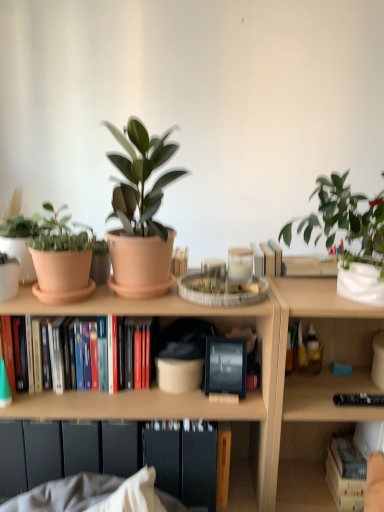
Question: From a real-world perspective, is white matte vase at upper right, the 2th flowerpot from the left, under hardcover books at center left, which is counted as the 2th book, starting from the bottom?

Choices:
 (A) yes
 (B) no

Answer: (B)

Question: From the image's perspective, is white matte vase at upper right, the 1th flowerpot positioned from the right, under hardcover books at center left, which is counted as the 1th book, starting from the top?

Choices:
 (A) no
 (B) yes

Answer: (A)

Question: Considering the relative sizes of white matte vase at upper right, the 2th flowerpot from the left, and hardcover books at center left, which is counted as the 1th book, starting from the top, in the image provided, is white matte vase at upper right, the 2th flowerpot from the left, smaller than hardcover books at center left, which is counted as the 1th book, starting from the top,?

Choices:
 (A) yes
 (B) no

Answer: (A)

Question: Can you confirm if white matte vase at upper right, the 2th flowerpot from the left, is taller than hardcover books at center left, which is counted as the 2th book, starting from the bottom?

Choices:
 (A) yes
 (B) no

Answer: (B)

Question: Are white matte vase at upper right, the 2th flowerpot from the left, and hardcover books at center left, which is counted as the 2th book, starting from the bottom, located far from each other?

Choices:
 (A) no
 (B) yes

Answer: (A)

Question: Visually, is matte terracotta pot at center, which appears as the second houseplant when viewed from the back, positioned to the left or to the right of hardcover books at center left, acting as the 2th book starting from the right?

Choices:
 (A) right
 (B) left

Answer: (A)

Question: Looking at their shapes, would you say matte terracotta pot at center, the first houseplant in the left-to-right sequence, is wider or thinner than hardcover books at center left, acting as the first book starting from the left?

Choices:
 (A) thin
 (B) wide

Answer: (B)

Question: Do you think matte terracotta pot at center, the first houseplant in the left-to-right sequence, is within hardcover books at center left, acting as the first book starting from the left, or outside of it?

Choices:
 (A) inside
 (B) outside

Answer: (B)

Question: Based on their sizes in the image, would you say matte terracotta pot at center, which appears as the second houseplant when viewed from the back, is bigger or smaller than hardcover books at center left, acting as the 2th book starting from the right?

Choices:
 (A) small
 (B) big

Answer: (B)

Question: From a real-world perspective, is hardcover book at lower right, placed as the second book when sorted from top to bottom, physically located above or below white matte vase at upper right, the 2th flowerpot from the left?

Choices:
 (A) above
 (B) below

Answer: (B)

Question: Is hardcover book at lower right, marked as the 1th book in a bottom-to-top arrangement, inside or outside of white matte vase at upper right, the 2th flowerpot from the left?

Choices:
 (A) inside
 (B) outside

Answer: (B)

Question: From their relative heights in the image, would you say hardcover book at lower right, the 1th book in the right-to-left sequence, is taller or shorter than white matte vase at upper right, the 1th flowerpot positioned from the right?

Choices:
 (A) short
 (B) tall

Answer: (B)

Question: In the image, is hardcover book at lower right, marked as the 1th book in a bottom-to-top arrangement, positioned in front of or behind white matte vase at upper right, the 2th flowerpot from the left?

Choices:
 (A) behind
 (B) front

Answer: (A)

Question: In terms of size, does hardcover book at lower right, the 1th book in the right-to-left sequence, appear bigger or smaller than wooden bookcase at center?

Choices:
 (A) small
 (B) big

Answer: (A)

Question: Is hardcover book at lower right, the 1th book in the right-to-left sequence, to the left or to the right of wooden bookcase at center in the image?

Choices:
 (A) right
 (B) left

Answer: (A)